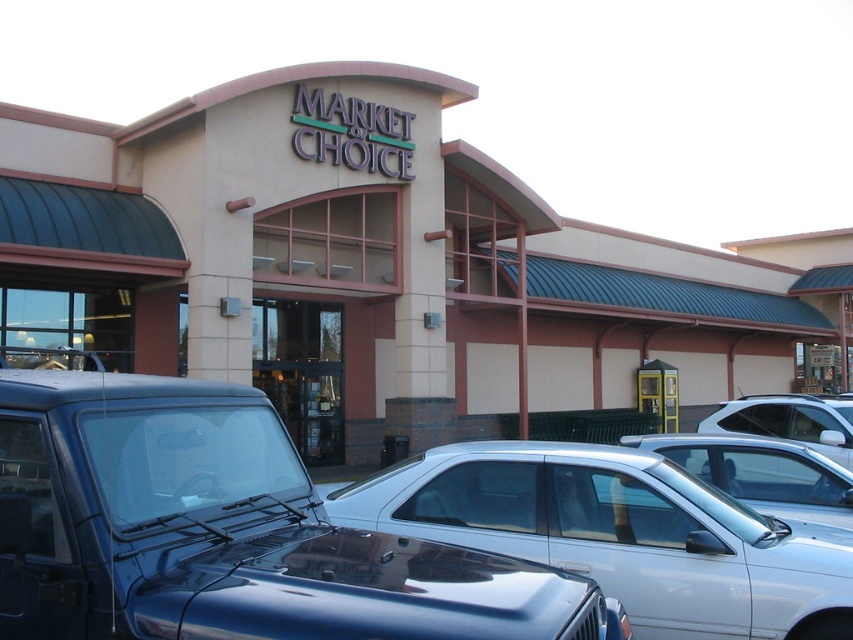
Question: Estimate the real-world distances between objects in this image. Which object is closer to the silver metallic sedan at center?

Choices:
 (A) metallic silver sedan at center
 (B) white glossy sedan at center
 (C) shiny blue suv at center
 (D) beige/smooth building at center

Answer: (C)

Question: Which object is positioned farthest from the white glossy sedan at center?

Choices:
 (A) beige/smooth building at center
 (B) shiny blue suv at center
 (C) metallic silver sedan at center

Answer: (C)

Question: Does shiny blue suv at center lie in front of metallic silver sedan at center?

Choices:
 (A) no
 (B) yes

Answer: (B)

Question: Does beige/smooth building at center appear on the right side of metallic silver sedan at center?

Choices:
 (A) no
 (B) yes

Answer: (B)

Question: Which point is farther from the camera taking this photo?

Choices:
 (A) (811, 403)
 (B) (103, 250)
 (C) (799, 465)

Answer: (B)

Question: Does beige/smooth building at center come behind shiny blue suv at center?

Choices:
 (A) yes
 (B) no

Answer: (A)